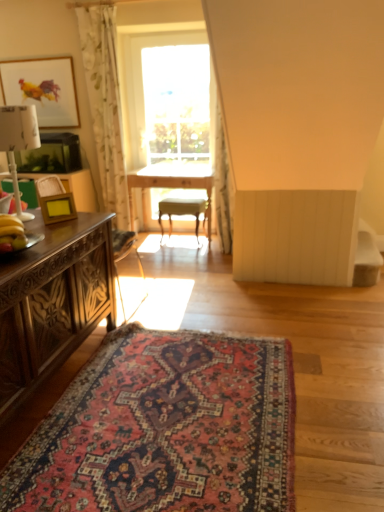
You are a GUI agent. You are given a task and a screenshot of the screen. Output one action in this format:
    pyautogui.click(x=<x>, y=<y>)
    Task: Click on the vacant region above matte wooden picture frame at upper left, the first picture frame when ordered from back to front (from a real-world perspective)
    This screenshot has width=384, height=512.
    Given the screenshot: What is the action you would take?
    pyautogui.click(x=47, y=51)